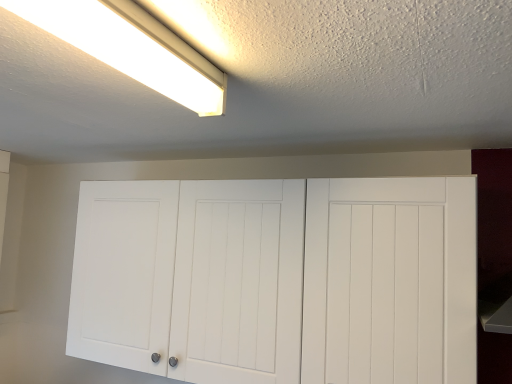
The image size is (512, 384). Identify the location of white matte cabinet at center. (278, 279).

The height and width of the screenshot is (384, 512). What do you see at coordinates (278, 279) in the screenshot?
I see `white matte cabinet at center` at bounding box center [278, 279].

Identify the location of white matte cabinet at center. This screenshot has width=512, height=384. (278, 279).